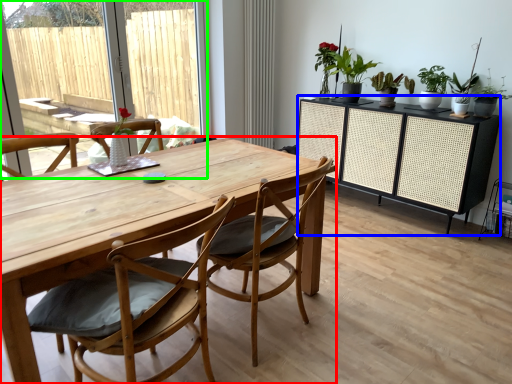
Question: Estimate the real-world distances between objects in this image. Which object is closer to table (highlighted by a red box), cabinetry (highlighted by a blue box) or window screen (highlighted by a green box)?

Choices:
 (A) cabinetry
 (B) window screen

Answer: (A)